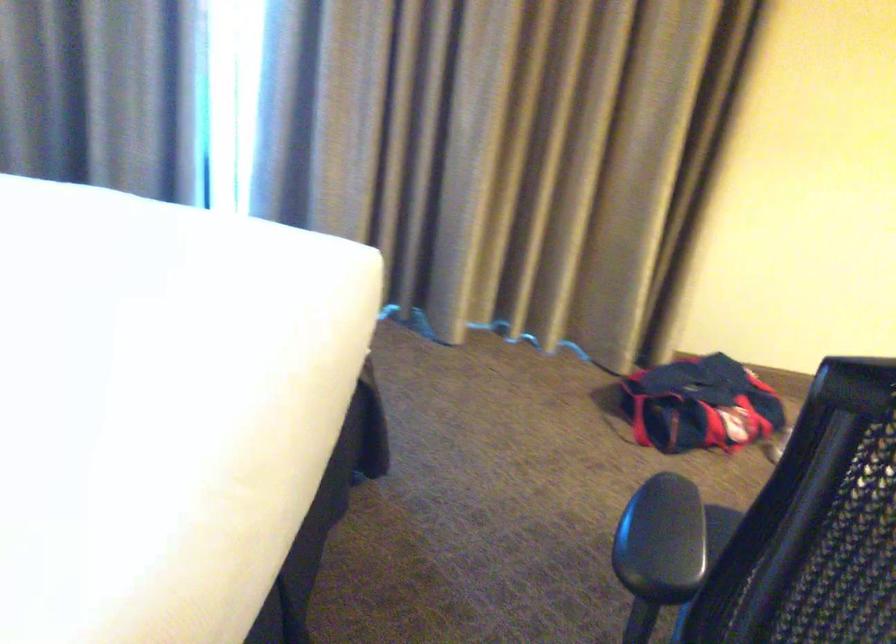
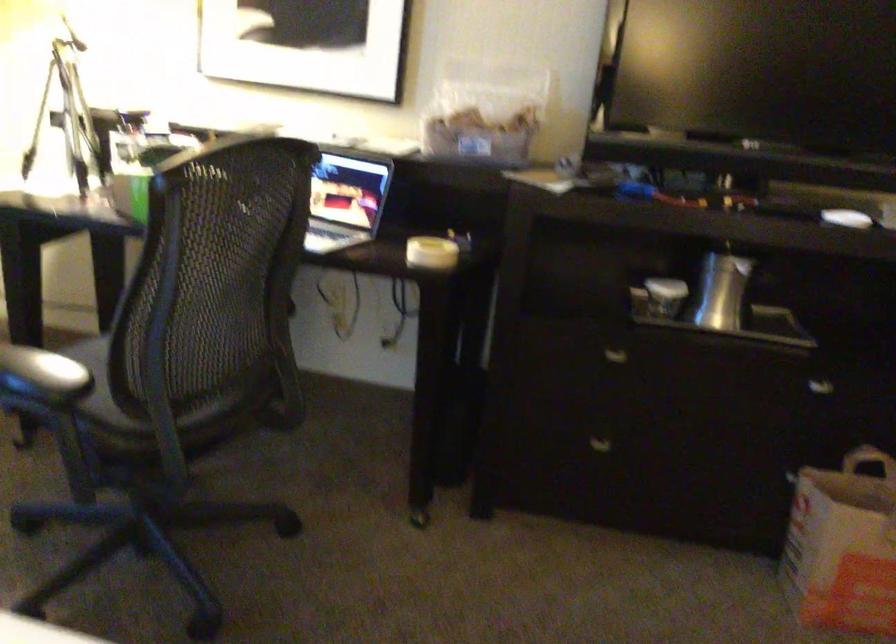
The point at (720, 573) is marked in the first image. Where is the corresponding point in the second image?

(124, 346)